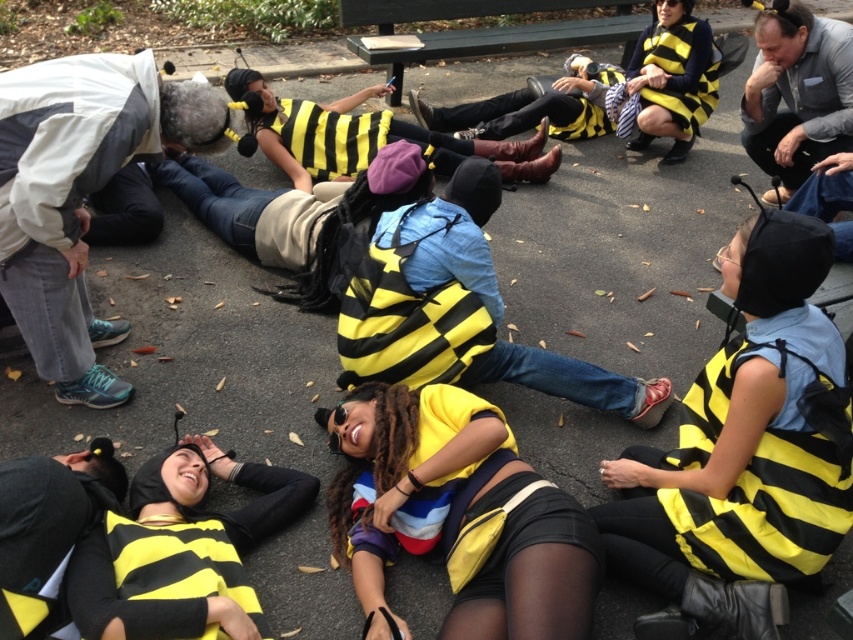
Question: Does yellow matte/yellow striped vest at lower center have a lesser width compared to yellow striped sweater at center?

Choices:
 (A) yes
 (B) no

Answer: (A)

Question: Is yellow matte/yellow striped vest at lower center above yellow striped sweater at center?

Choices:
 (A) no
 (B) yes

Answer: (A)

Question: Which point is farther from the camera taking this photo?

Choices:
 (A) (502, 172)
 (B) (457, 637)

Answer: (A)

Question: Which of the following is the closest to the observer?

Choices:
 (A) yellow matte/yellow striped vest at lower center
 (B) yellow striped sweater at center

Answer: (A)

Question: Can you confirm if yellow matte/yellow striped vest at lower center is positioned below yellow striped sweater at center?

Choices:
 (A) yes
 (B) no

Answer: (A)

Question: Among these points, which one is farthest from the camera?

Choices:
 (A) (314, 177)
 (B) (573, 522)

Answer: (A)